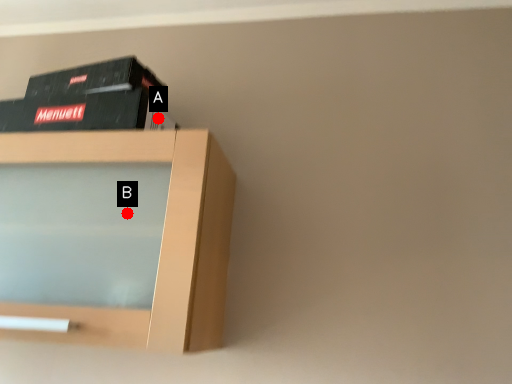
Question: Two points are circled on the image, labeled by A and B beside each circle. Among these points, which one is nearest to the camera?

Choices:
 (A) A is closer
 (B) B is closer

Answer: (B)